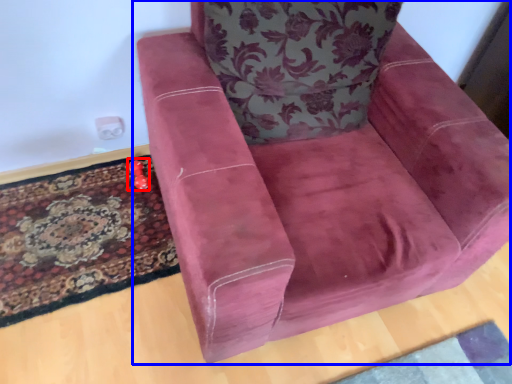
Question: Which point is further to the camera, toy (highlighted by a red box) or chair (highlighted by a blue box)?

Choices:
 (A) toy
 (B) chair

Answer: (A)